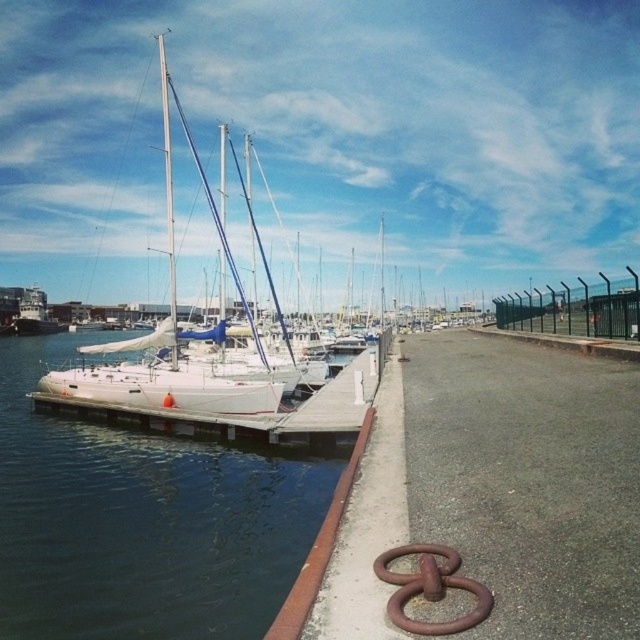
Based on the photo, you are standing on the concrete walkway and want to know which object is taller between the white glossy sailboat at center and the smooth white mast at center. Can you tell me?

The smooth white mast at center is taller than the white glossy sailboat at center.

You are standing at the concrete walkway in the marina scene and want to move from point A to point B. Point A is located at coordinates point (166,436) and point B is at point (300,570). Since you can only move forward, will you be moving towards or away from the viewer as you go from point A to point B?

Moving from point A to point B means moving away from the viewer because point A is closer to the viewer than point B.

You are standing on the concrete walkway near the reddish brown metal railing with a large rusty metal ring. You want to walk directly towards the white glossy sailboat at center. Based on its 2D location coordinates, in which direction should you turn first to face the sailboat?

The white glossy sailboat at center is located at coordinates 0.545 on the x axis and 0.255 on the y axis. Since the walkway curves slightly to the right in the distance, you should turn to your right to align with the sailboat.